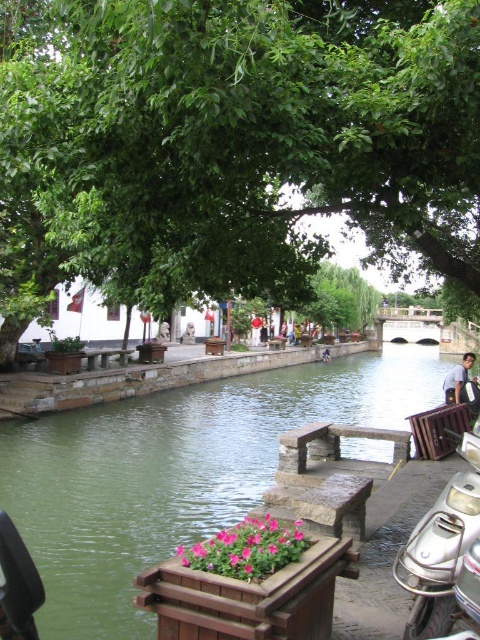
How distant is green leafy tree at upper center from green stone river at center?

They are 6.97 meters apart.

Who is shorter, green leafy tree at upper center or green stone river at center?

With less height is green stone river at center.

Who is more forward, [468,291] or [64,564]?

Positioned in front is point [64,564].

Find the location of `green leafy tree at upper center`. green leafy tree at upper center is located at coordinates (231, 147).

Between point (362, 164) and point (458, 442), which one is positioned in front?

Point (362, 164) is more forward.

Who is positioned more to the left, green leafy tree at upper center or silver metallic motorcycle at lower right?

From the viewer's perspective, green leafy tree at upper center appears more on the left side.

Does point (298, 188) come closer to viewer compared to point (453, 516)?

No, (298, 188) is further to viewer.

Locate an element on the screen. green leafy tree at upper center is located at coordinates (231, 147).

Consider the image. Measure the distance between green stone river at center and matte white shirt at center.

green stone river at center and matte white shirt at center are 13.83 meters apart.

Does green stone river at center have a smaller size compared to matte white shirt at center?

No, green stone river at center is not smaller than matte white shirt at center.

Identify the location of green stone river at center. (173, 472).

Locate an element on the screen. This screenshot has height=640, width=480. green stone river at center is located at coordinates (173, 472).